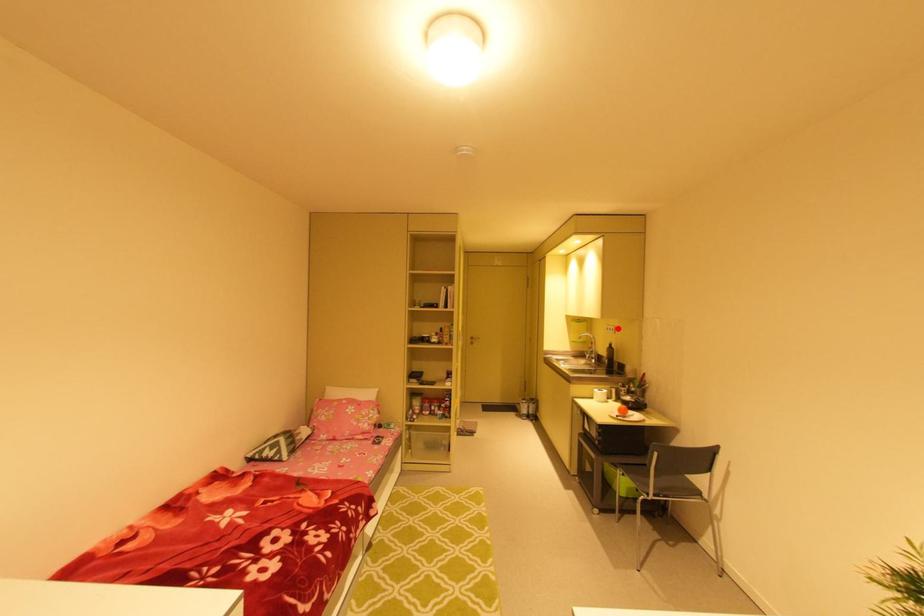
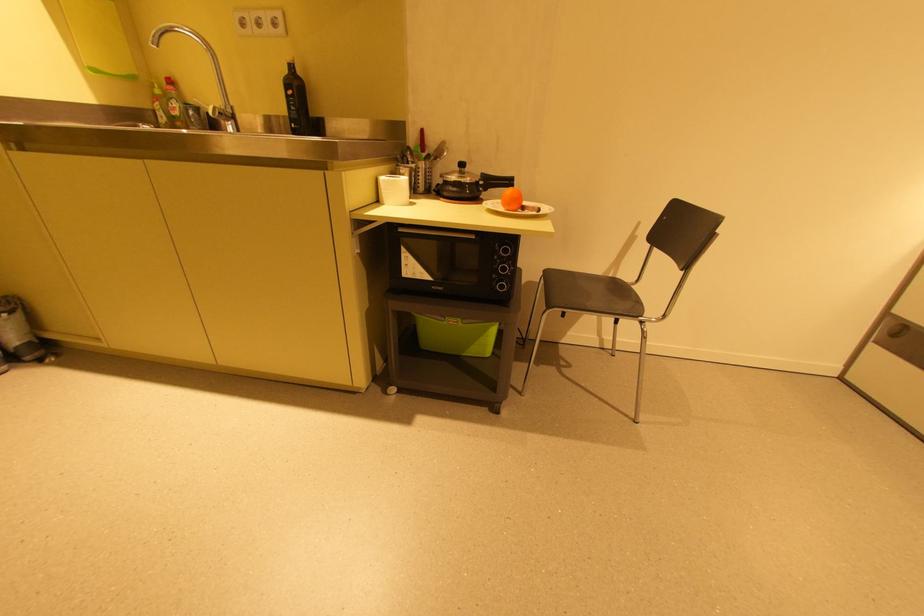
Locate, in the second image, the point that corresponds to the highlighted location in the first image.

(284, 15)